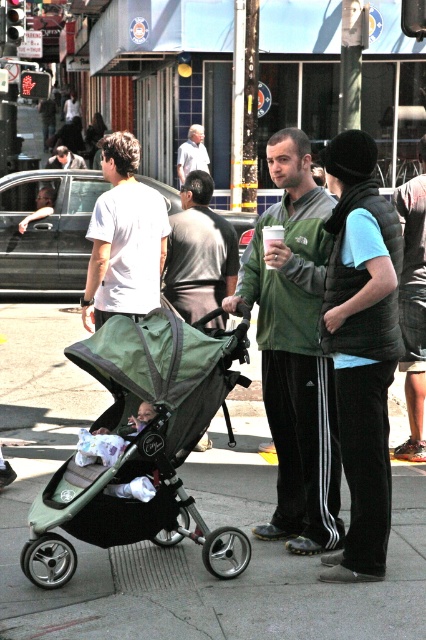
Who is more forward, (342, 288) or (420, 150)?

Positioned in front is point (342, 288).

Does green puffy vest at center have a greater width compared to dark gray vest at center?

Incorrect, green puffy vest at center's width does not surpass dark gray vest at center's.

Between point (359, 340) and point (409, 268), which one is positioned behind?

The point (409, 268) is more distant.

What are the coordinates of `green puffy vest at center` in the screenshot? It's located at (342, 237).

Can you confirm if dark gray vest at center is bigger than light gray shirt at center?

Indeed, dark gray vest at center has a larger size compared to light gray shirt at center.

Who is shorter, dark gray vest at center or light gray shirt at center?

light gray shirt at center is shorter.

What are the coordinates of `dark gray vest at center` in the screenshot? It's located at [412, 307].

Is point (316, 419) positioned before point (192, 147)?

Yes, it is.

Between green matte jacket at center and light gray shirt at center, which one is positioned higher?

light gray shirt at center is higher up.

The image size is (426, 640). Identify the location of green matte jacket at center. (294, 349).

The width and height of the screenshot is (426, 640). What are the coordinates of `green matte jacket at center` in the screenshot? It's located at (294, 349).